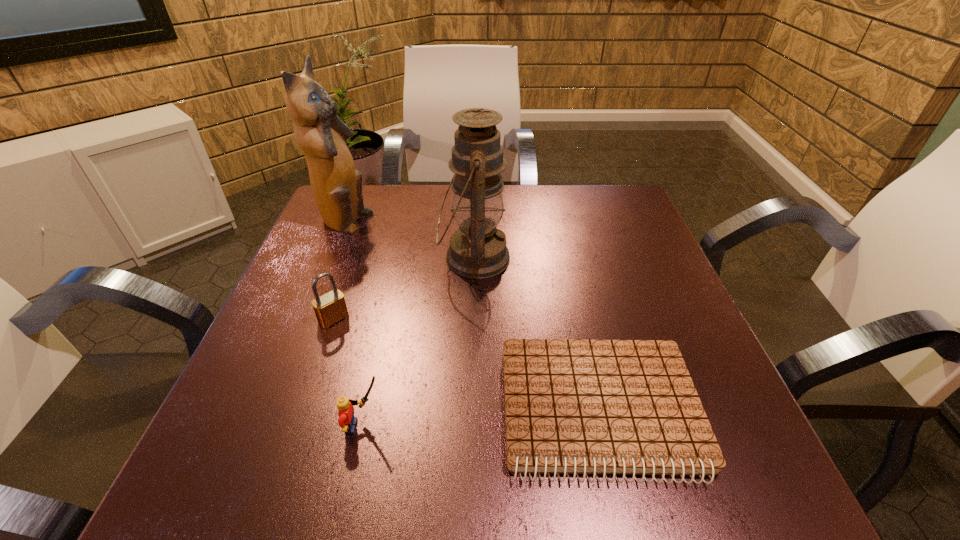
Image resolution: width=960 pixels, height=540 pixels. I want to click on cat located at the far edge, so click(x=336, y=185).

Image resolution: width=960 pixels, height=540 pixels. Find the location of `oil lamp present at the far edge`. oil lamp present at the far edge is located at coordinates (477, 250).

Find the location of a particular element. Image resolution: width=960 pixels, height=540 pixels. object present at the near edge is located at coordinates (575, 407).

At what (x,y) coordinates should I click in order to perform the action: click on cat at the left edge. Please return your answer as a coordinate pair (x, y). The height and width of the screenshot is (540, 960). Looking at the image, I should click on (336, 185).

Identify the location of padlock positioned at the left edge. (329, 308).

Locate an element on the screen. object that is at the right edge is located at coordinates (575, 407).

This screenshot has width=960, height=540. I want to click on object that is at the far left corner, so click(336, 185).

Find the location of a particular element. object at the near right corner is located at coordinates pyautogui.click(x=575, y=407).

The width and height of the screenshot is (960, 540). In order to click on free space at the far edge of the desktop in this screenshot , I will do `click(519, 211)`.

This screenshot has width=960, height=540. In the image, there is a desktop. Find the location of `vacant space at the left edge`. vacant space at the left edge is located at coordinates (348, 295).